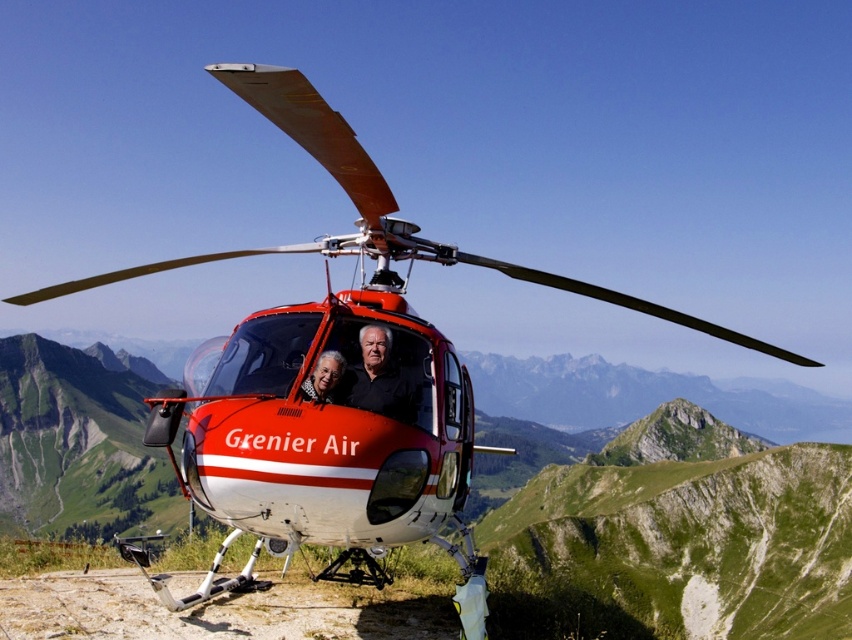
You are a photographer trying to capture both the black matte shirt at center and the smooth black shirt at center in a single frame. Which shirt should you focus on to ensure both are in the frame without moving the camera?

You should focus on the black matte shirt at center because it is larger and will remain in the frame even if the smaller smooth black shirt at center is positioned towards the edges.

You are a photographer at the scene of the helicopter. You need to capture a clear photo of both the black matte shirt at center and the smooth black shirt at center. Which one will appear larger in the photo?

The black matte shirt at center will appear larger in the photo because it is much taller than the smooth black shirt at center.

You are a photographer taking a picture of the two individuals in the helicopter cockpit. You notice both the black matte shirt at center and the smooth black shirt at center. Which shirt will appear closer to the camera in the photo?

The black matte shirt at center will appear closer to the camera because it is positioned further to the viewer than the smooth black shirt at center.